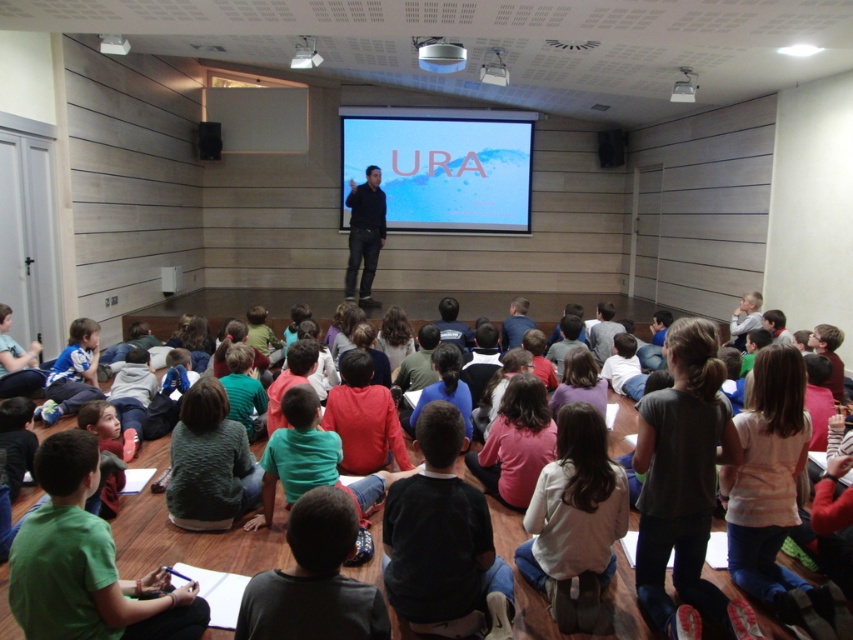
Question: Which point appears closest to the camera in this image?

Choices:
 (A) (602, 317)
 (B) (364, 246)
 (C) (602, 131)

Answer: (A)

Question: Which of these objects is positioned farthest from the green matte shirt at lower left?

Choices:
 (A) dark blue jeans at center
 (B) dark green shirt at center
 (C) black matte speaker at upper right

Answer: (C)

Question: Does white glossy projection screen at center have a lesser width compared to green knitted sweater at center?

Choices:
 (A) no
 (B) yes

Answer: (A)

Question: Is white matte shirt at center above green knitted sweater at center?

Choices:
 (A) yes
 (B) no

Answer: (B)

Question: Is green knitted sweater at center further to camera compared to black matte speaker at upper center?

Choices:
 (A) no
 (B) yes

Answer: (A)

Question: Which object is positioned farthest from the black matte speaker at upper right?

Choices:
 (A) dark green shirt at center
 (B) green matte shirt at lower left
 (C) dark blue jeans at center
 (D) black matte speaker at upper center

Answer: (B)